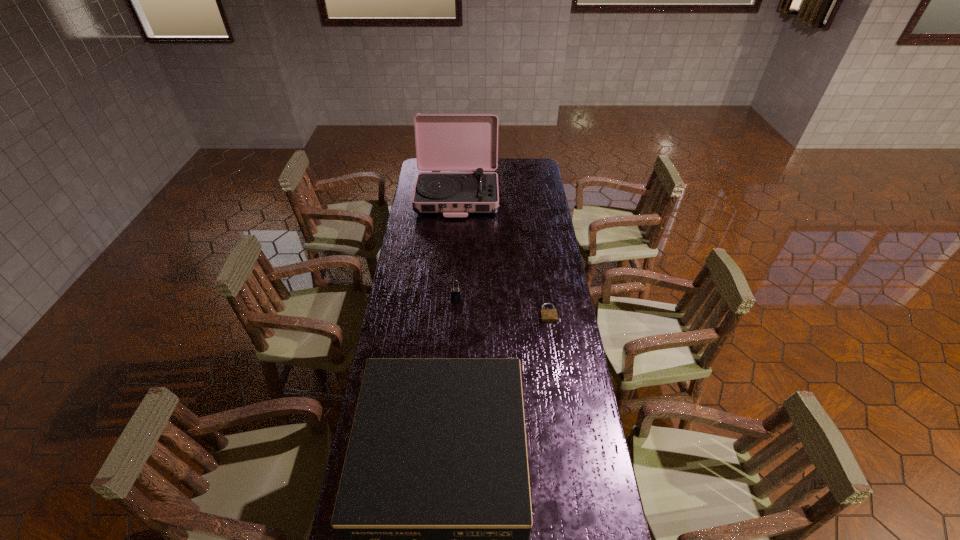
Where is `object situated at the left edge`? The height and width of the screenshot is (540, 960). object situated at the left edge is located at coordinates (444, 142).

Where is `object located at the right edge`? The width and height of the screenshot is (960, 540). object located at the right edge is located at coordinates (547, 315).

Find the location of a particular element. The image size is (960, 540). object that is at the far left corner is located at coordinates (444, 142).

Where is `vacant space at the right edge`? vacant space at the right edge is located at coordinates (545, 286).

In the image, there is a desktop. What are the coordinates of `free space at the far right corner` in the screenshot? It's located at click(523, 159).

At what (x,y) coordinates should I click in order to perform the action: click on vacant point located between the farthest object and the third nearest object. Please return your answer as a coordinate pair (x, y). This screenshot has width=960, height=540. Looking at the image, I should click on (457, 246).

Locate an element on the screen. free area in between the taller padlock and the farthest object is located at coordinates (457, 246).

This screenshot has height=540, width=960. Find the location of `vacant area that lies between the shortest object and the farthest object`. vacant area that lies between the shortest object and the farthest object is located at coordinates [503, 254].

At what (x,y) coordinates should I click in order to perform the action: click on free space between the third farthest object and the record player. Please return your answer as a coordinate pair (x, y). The width and height of the screenshot is (960, 540). Looking at the image, I should click on [503, 254].

The width and height of the screenshot is (960, 540). I want to click on vacant area between the third nearest object and the tallest object, so click(457, 246).